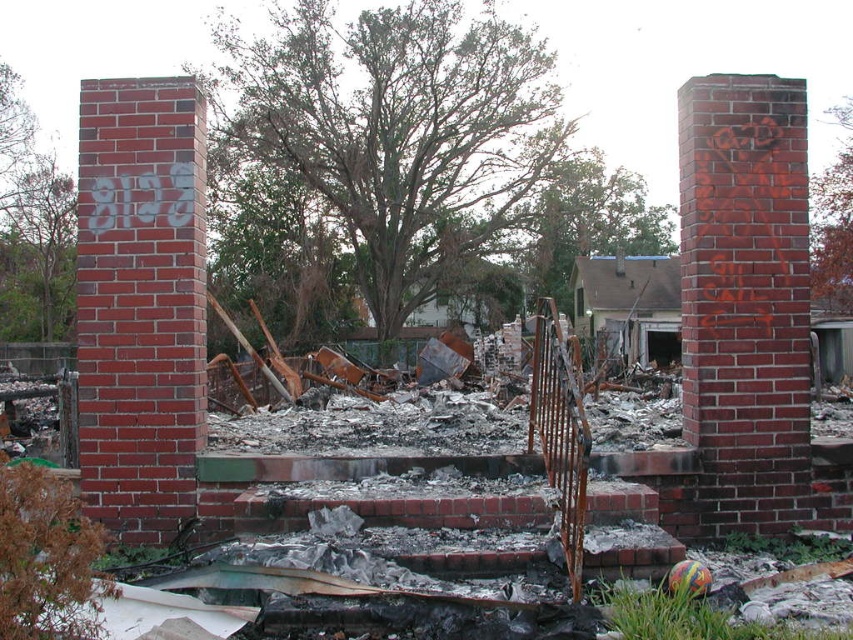
You are a firefighter assessing the scene. You see the red brick chimney at center and the red brick chimney at left. Which chimney is positioned to the right of the other?

The red brick chimney at center is positioned to the right of the red brick chimney at left.